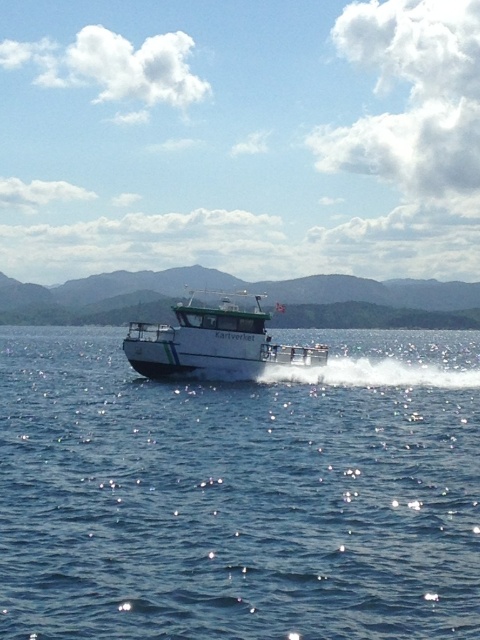
Can you confirm if blue water at center is wider than white glossy boat at center?

Indeed, blue water at center has a greater width compared to white glossy boat at center.

Is point (20, 403) positioned in front of point (179, 314)?

Yes, point (20, 403) is in front of point (179, 314).

I want to click on blue water at center, so click(x=240, y=492).